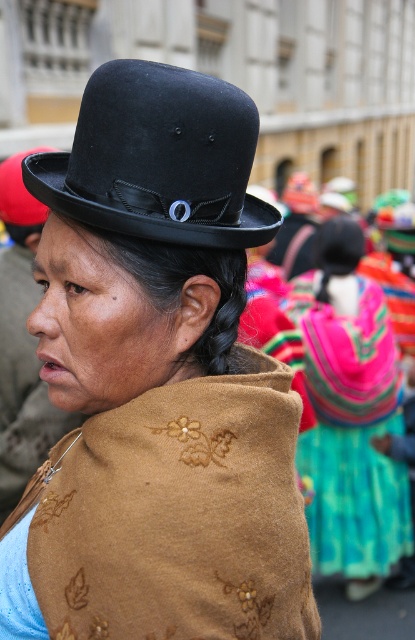
Question: Which object is the farthest from the multicolored woven skirt at center?

Choices:
 (A) black felt hat at upper center
 (B) matte black hat at upper center

Answer: (A)

Question: Considering the real-world distances, which object is closest to the matte black hat at upper center?

Choices:
 (A) multicolored woven skirt at center
 (B) black felt hat at upper center

Answer: (B)

Question: Can you confirm if matte black hat at upper center is wider than black felt hat at upper center?

Choices:
 (A) yes
 (B) no

Answer: (A)

Question: Based on their relative distances, which object is nearer to the matte black hat at upper center?

Choices:
 (A) multicolored woven skirt at center
 (B) black felt hat at upper center

Answer: (B)

Question: Is matte black hat at upper center further to the viewer compared to multicolored woven skirt at center?

Choices:
 (A) yes
 (B) no

Answer: (B)

Question: Can you confirm if matte black hat at upper center is bigger than black felt hat at upper center?

Choices:
 (A) yes
 (B) no

Answer: (A)